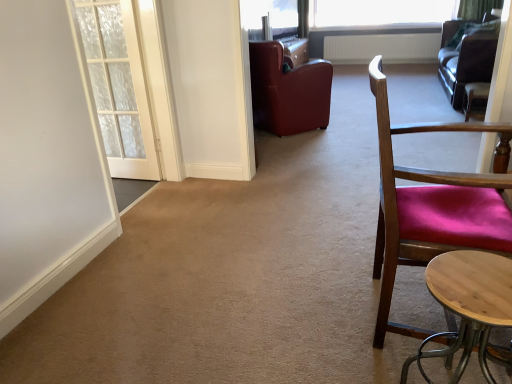
Question: Is white textured radiator at upper center located within wooden chair with red cushion at right, the third chair in the back-to-front sequence?

Choices:
 (A) yes
 (B) no

Answer: (B)

Question: Is wooden chair with red cushion at right, which appears as the 2th chair when viewed from the left, positioned with its back to white textured radiator at upper center?

Choices:
 (A) yes
 (B) no

Answer: (B)

Question: Can you confirm if wooden chair with red cushion at right, the third chair in the back-to-front sequence, is thinner than white textured radiator at upper center?

Choices:
 (A) no
 (B) yes

Answer: (A)

Question: Would you say wooden chair with red cushion at right, which is the second chair in right-to-left order, is outside white textured radiator at upper center?

Choices:
 (A) no
 (B) yes

Answer: (B)

Question: Is wooden chair with red cushion at right, which is the second chair in right-to-left order, positioned before white textured radiator at upper center?

Choices:
 (A) no
 (B) yes

Answer: (B)

Question: From the image's perspective, is wooden chair with red cushion at right, which is counted as the first chair, starting from the front, below white textured radiator at upper center?

Choices:
 (A) yes
 (B) no

Answer: (A)

Question: Does white textured radiator at upper center have a lesser width compared to velvet burgundy chair at right, the 1th chair in the right-to-left sequence?

Choices:
 (A) yes
 (B) no

Answer: (A)

Question: From the image's perspective, is white textured radiator at upper center on velvet burgundy chair at right, arranged as the third chair when viewed from the left?

Choices:
 (A) no
 (B) yes

Answer: (B)

Question: Can you confirm if white textured radiator at upper center is smaller than velvet burgundy chair at right, arranged as the third chair when viewed from the left?

Choices:
 (A) no
 (B) yes

Answer: (A)

Question: From the image's perspective, is white textured radiator at upper center below velvet burgundy chair at right, the 1th chair in the right-to-left sequence?

Choices:
 (A) no
 (B) yes

Answer: (A)

Question: Can you confirm if white textured radiator at upper center is taller than velvet burgundy chair at right, the 1th chair in the right-to-left sequence?

Choices:
 (A) yes
 (B) no

Answer: (A)

Question: Is white textured radiator at upper center turned away from velvet burgundy chair at right, arranged as the third chair when viewed from the left?

Choices:
 (A) yes
 (B) no

Answer: (B)

Question: Is white textured radiator at upper center next to white sheer curtain at upper right and touching it?

Choices:
 (A) yes
 (B) no

Answer: (B)